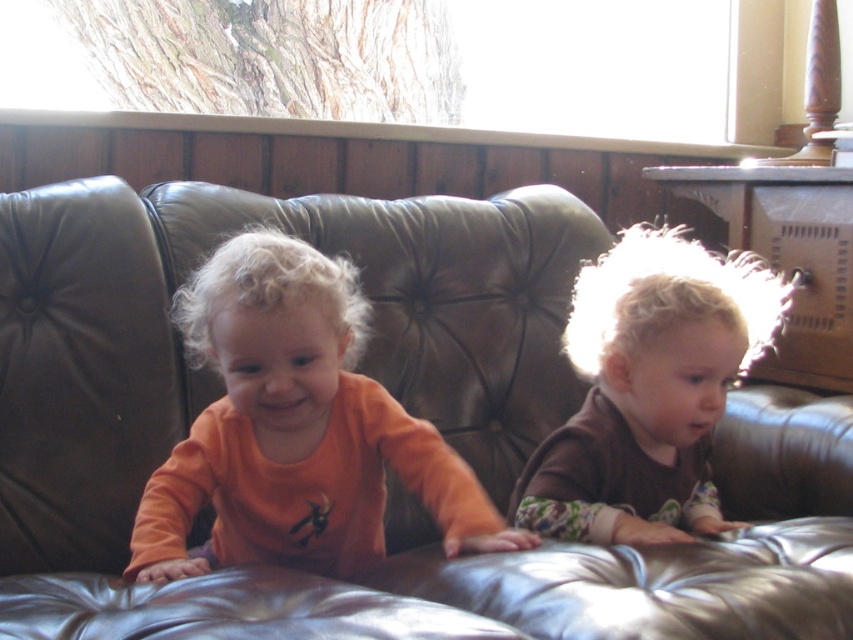
Looking at this image, you are a photographer standing at the camera position. You want to place a small decoration exactly 1.22 meters away from your current position. Can you use the point marked at coordinates point (20,392) to place it?

Yes, the point marked at coordinates point (20,392) is exactly 1.22 meters away from the camera, so you can place the decoration there.

You are a photographer setting up a shoot in this living room. You need to place a large tripod between the leather couch at center and the brown fuzzy sweater at right. Based on their positions, where should you position the tripod to ensure it is between them?

The leather couch at center is located below the brown fuzzy sweater at right, so you should place the tripod between them by positioning it in the space between the lower leather couch at center and the higher brown fuzzy sweater at right.